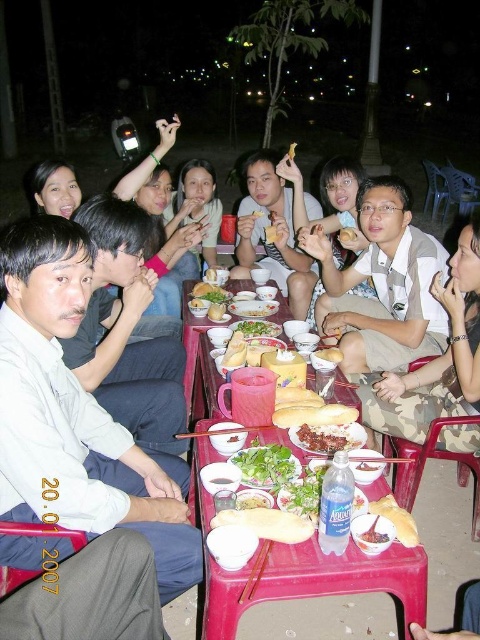
The height and width of the screenshot is (640, 480). What do you see at coordinates (74, 413) in the screenshot? I see `white matte shirt at left` at bounding box center [74, 413].

Which is in front, point (160, 461) or point (269, 326)?

Point (160, 461) is more forward.

You are a GUI agent. You are given a task and a screenshot of the screen. Output one action in this format:
    pyautogui.click(x=<x>, y=<y>)
    Task: Click on the white matte shirt at left
    This screenshot has height=640, width=480.
    Given the screenshot: What is the action you would take?
    pyautogui.click(x=74, y=413)

Can you confirm if matte black shirt at center is positioned below smooth yellow bread at center?

Yes.

Does matte black shirt at center come in front of smooth yellow bread at center?

Yes, matte black shirt at center is closer to the viewer.

The width and height of the screenshot is (480, 640). In order to click on matte black shirt at center in this screenshot , I will do `click(330, 196)`.

From the picture: Who is positioned more to the left, smooth white rice bowl at center or smooth yellow bread at center?

Positioned to the left is smooth white rice bowl at center.

Is point (385, 536) in front of point (352, 234)?

Yes, point (385, 536) is closer to viewer.

At what (x,y) coordinates should I click in order to perform the action: click on smooth white rice bowl at center. Please return your answer as a coordinate pair (x, y). Looking at the image, I should click on pos(373,532).